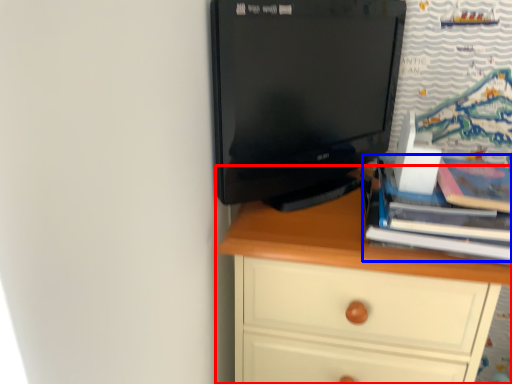
Question: Which of the following is the closest to the observer, chest of drawers (highlighted by a red box) or book (highlighted by a blue box)?

Choices:
 (A) chest of drawers
 (B) book

Answer: (B)